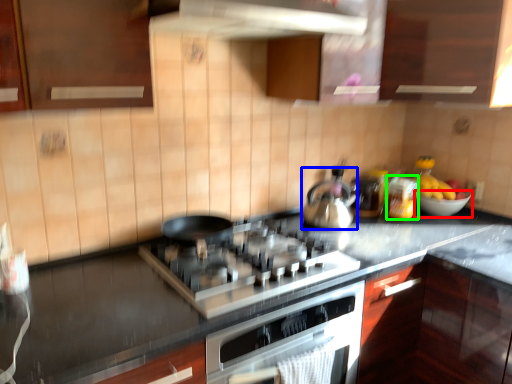
Question: Considering the real-world distances, which object is farthest from bowl (highlighted by a red box)? kitchen appliance (highlighted by a blue box) or appliance (highlighted by a green box)?

Choices:
 (A) kitchen appliance
 (B) appliance

Answer: (A)